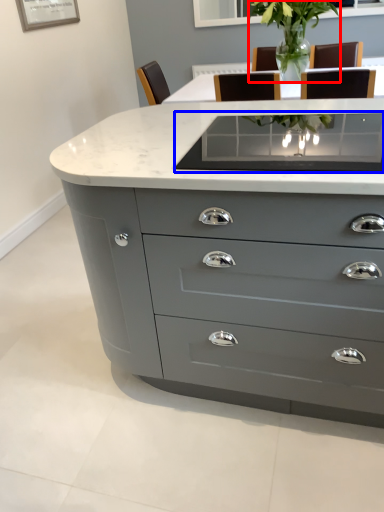
Question: Which point is closer to the camera, plant (highlighted by a red box) or glass table (highlighted by a blue box)?

Choices:
 (A) plant
 (B) glass table

Answer: (B)